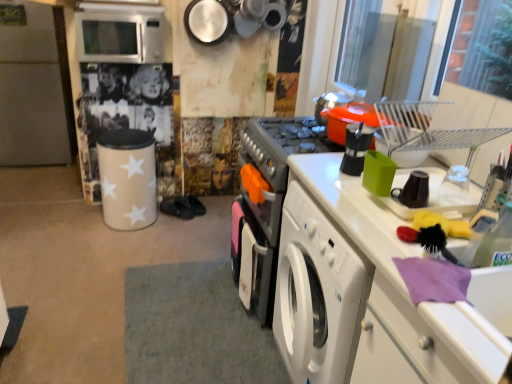
Question: From a real-world perspective, is white matte refrigerator at left physically located above or below satin silver microwave at upper left?

Choices:
 (A) below
 (B) above

Answer: (A)

Question: Looking at the image, does white matte refrigerator at left seem bigger or smaller compared to satin silver microwave at upper left?

Choices:
 (A) small
 (B) big

Answer: (A)

Question: Considering the relative positions of white matte refrigerator at left and satin silver microwave at upper left in the image provided, is white matte refrigerator at left to the left or to the right of satin silver microwave at upper left?

Choices:
 (A) left
 (B) right

Answer: (A)

Question: From the image's perspective, relative to white matte refrigerator at left, is satin silver microwave at upper left above or below?

Choices:
 (A) below
 (B) above

Answer: (B)

Question: Does point (96, 39) appear closer or farther from the camera than point (62, 96)?

Choices:
 (A) closer
 (B) farther

Answer: (A)

Question: Based on their positions, is satin silver microwave at upper left located to the left or right of white matte refrigerator at left?

Choices:
 (A) left
 (B) right

Answer: (B)

Question: Do you think satin silver microwave at upper left is within white matte refrigerator at left, or outside of it?

Choices:
 (A) outside
 (B) inside

Answer: (A)